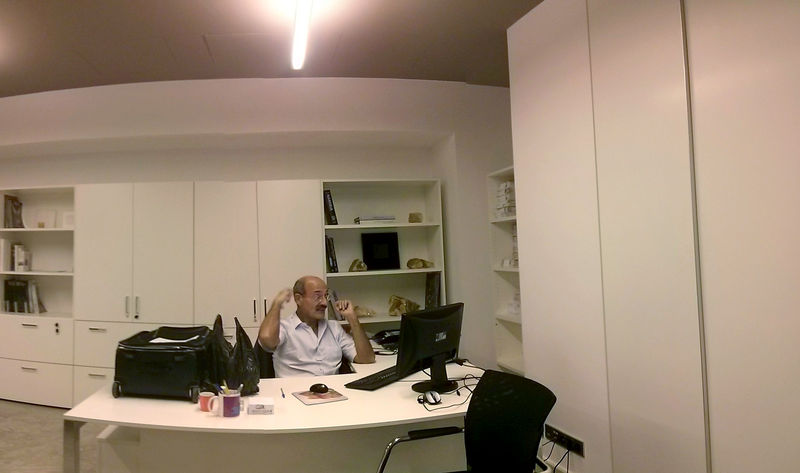
You are a GUI agent. You are given a task and a screenshot of the screen. Output one action in this format:
    pyautogui.click(x=<x>, y=<y>)
    Task: Click on the keyboard
    The width and height of the screenshot is (800, 473).
    Given the screenshot: What is the action you would take?
    coord(386,381)